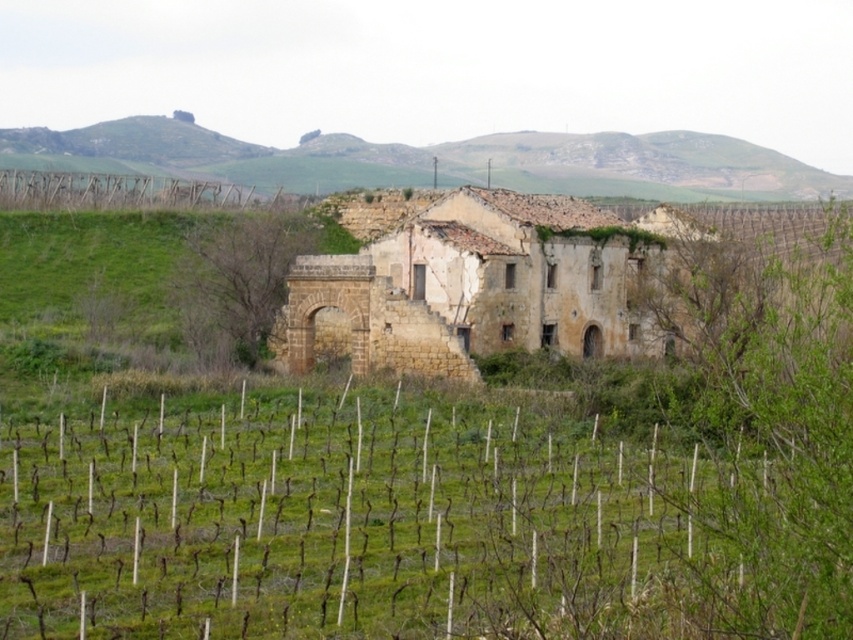
Can you confirm if brown grass at center is positioned below green grassy hillside at upper center?

Yes.

Between brown grass at center and green grassy hillside at upper center, which one has more height?

green grassy hillside at upper center

Between point (486, 474) and point (239, 161), which one is positioned in front?

Point (486, 474) is more forward.

The width and height of the screenshot is (853, 640). I want to click on brown grass at center, so click(340, 525).